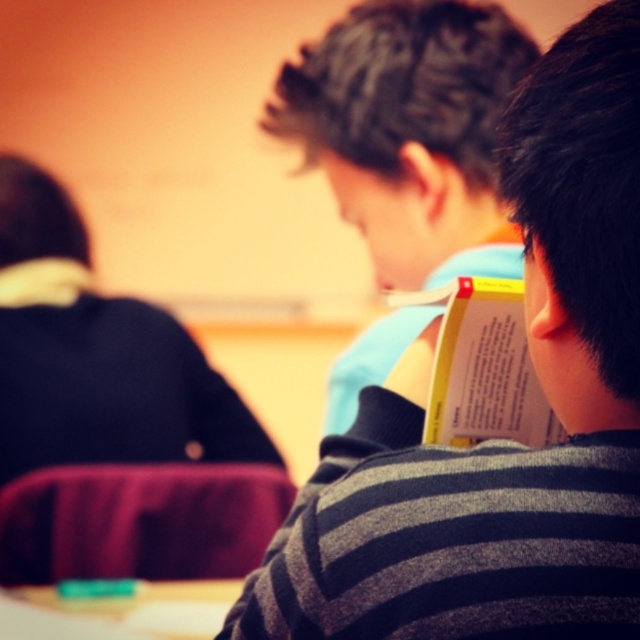
What do you see at coordinates (500, 442) in the screenshot?
I see `striped sweater at center` at bounding box center [500, 442].

Is striped sweater at center to the right of dark blue sweater at left from the viewer's perspective?

Correct, you'll find striped sweater at center to the right of dark blue sweater at left.

At what (x,y) coordinates should I click in order to perform the action: click on striped sweater at center. Please return your answer as a coordinate pair (x, y). The height and width of the screenshot is (640, 640). Looking at the image, I should click on (500, 442).

This screenshot has height=640, width=640. In order to click on striped sweater at center in this screenshot , I will do `click(500, 442)`.

Based on the photo, which of these two, striped sweater at center or green plastic eraser at lower left, stands shorter?

Standing shorter between the two is green plastic eraser at lower left.

Is point (608, 113) positioned in front of point (116, 596)?

Yes, it is.

Where is `striped sweater at center`? striped sweater at center is located at coordinates (500, 442).

Is point (99, 307) farther from camera compared to point (109, 602)?

Yes, it is behind point (109, 602).

Does dark blue sweater at left have a greater width compared to green plastic eraser at lower left?

Yes, dark blue sweater at left is wider than green plastic eraser at lower left.

The width and height of the screenshot is (640, 640). Identify the location of dark blue sweater at left. (113, 419).